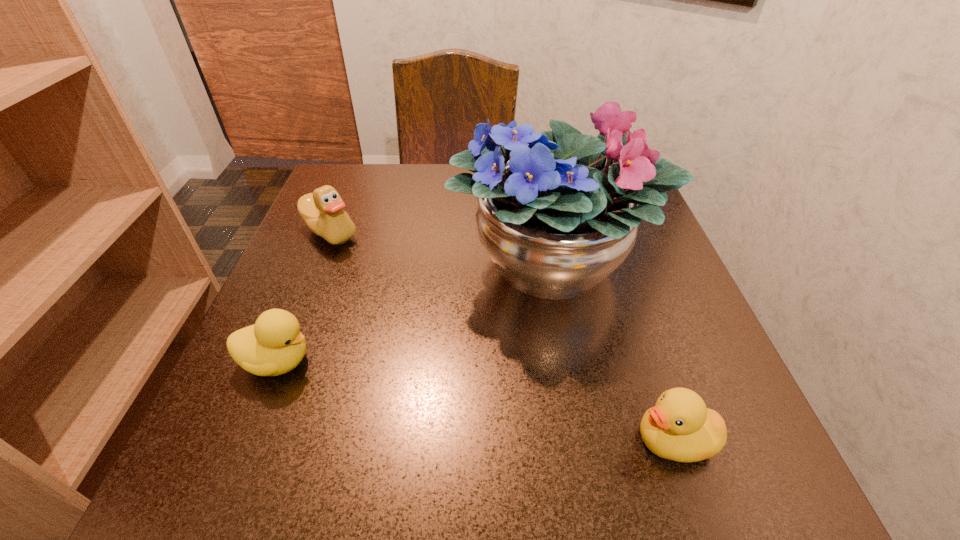
Find the location of a particular element. vacant space located at the beak of the nearest object is located at coordinates (354, 440).

The height and width of the screenshot is (540, 960). Identify the location of bouquet positioned at the far edge. (556, 219).

Identify the location of duck located in the far edge section of the desktop. pyautogui.click(x=322, y=211).

Identify the location of object that is at the near edge. (679, 427).

I want to click on bouquet located in the right edge section of the desktop, so click(556, 219).

This screenshot has width=960, height=540. I want to click on duck that is positioned at the right edge, so click(679, 427).

Find the location of a particular element. object located in the far left corner section of the desktop is located at coordinates 322,211.

Locate an element on the screen. This screenshot has width=960, height=540. object positioned at the far right corner is located at coordinates (556, 219).

Identify the location of object that is at the near right corner. (679, 427).

Find the location of a particular element. The image size is (960, 540). vacant space at the far edge of the desktop is located at coordinates (404, 195).